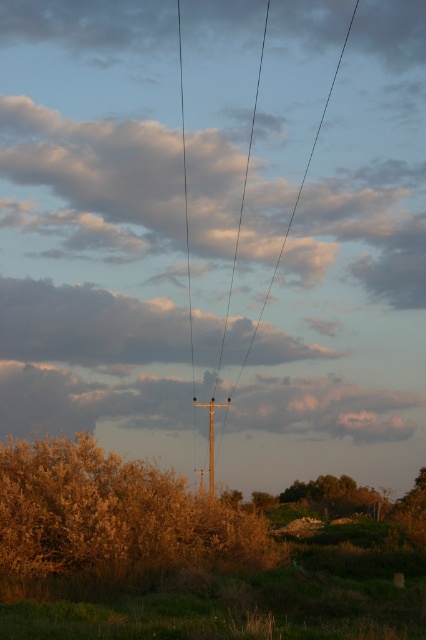
Question: In this image, where is brown leafy bush at lower left located relative to black wire at center?

Choices:
 (A) above
 (B) below

Answer: (B)

Question: Which of the following is the farthest from the observer?

Choices:
 (A) (195, 401)
 (B) (236, 340)

Answer: (A)

Question: Which is farther from the black wire at center?

Choices:
 (A) cloudy sky at center
 (B) smooth wood telegraph pole at center

Answer: (B)

Question: Can you confirm if brown leafy bush at lower left is positioned to the left of cloudy sky at upper center?

Choices:
 (A) yes
 (B) no

Answer: (B)

Question: Among these objects, which one is nearest to the camera?

Choices:
 (A) smooth wood telegraph pole at center
 (B) black wire at center
 (C) cloudy sky at upper center

Answer: (A)

Question: Is brown leafy bush at lower left wider than cloudy sky at upper center?

Choices:
 (A) yes
 (B) no

Answer: (B)